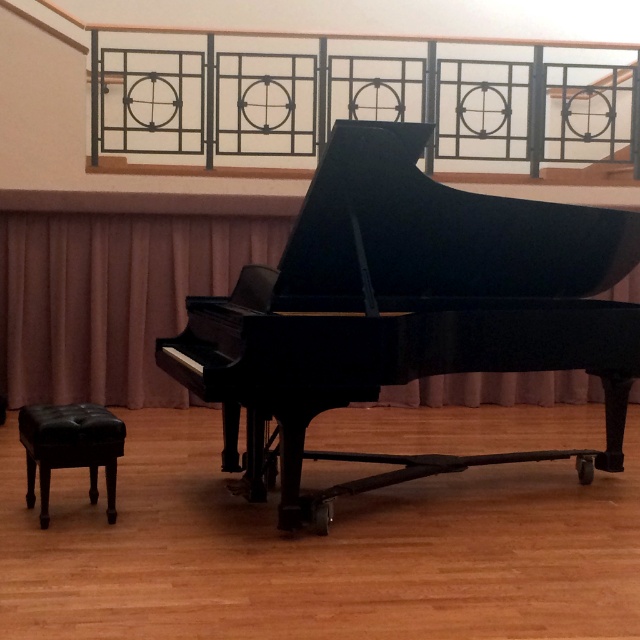
Consider the image. You are a stagehand setting up for a concert. The metallic black railing at upper center is part of the stage. You need to position a 3.5 meter long piano behind the railing so it doesn t block the audience view. Can the piano be placed there without overlapping the railing?

The distance between the metallic black railing at upper center and the camera is 6.89 meters. Since the piano is 3.5 meters long, placing it behind the railing would leave enough space between the railing and the piano. Therefore, the piano can be positioned there without overlapping the railing.

You are a musician who needs to adjust the distance between the black polished piano at center and the black leather stool at lower left to 1.5 meters for a performance. Based on the current setup shown in the image, should you move the stool closer to or farther away from the piano?

The current distance between the black polished piano at center and the black leather stool at lower left is 1.25 meters. To reach 1.5 meters, you need to move the stool farther away from the piano.

You are a stagehand setting up for a performance. You need to ensure that the matte pink curtain at center and the black leather stool at lower left are positioned so that the taller object is behind the shorter one for visibility. Which object should be placed behind the other?

The matte pink curtain at center is taller than the black leather stool at lower left, so the curtain should be placed behind the stool to ensure visibility.